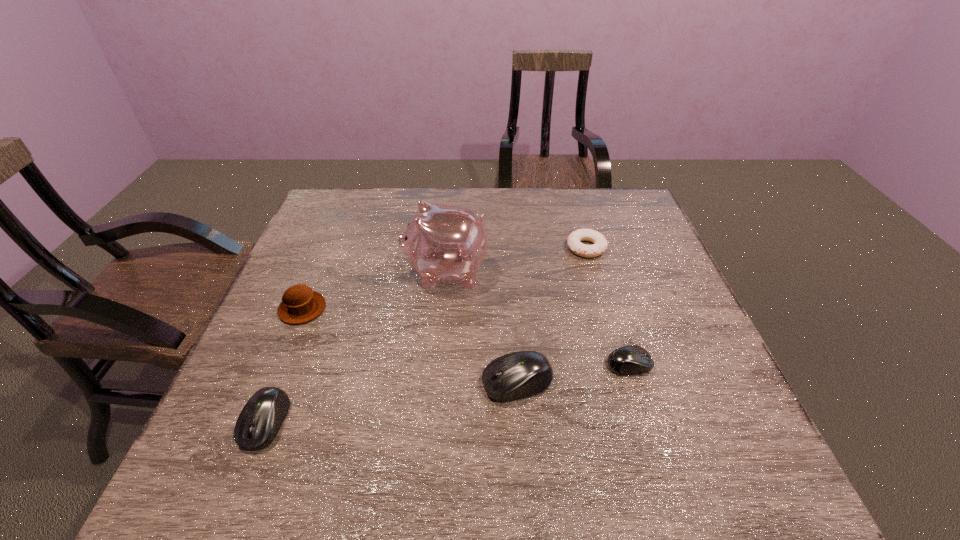
Find the location of a particular element. vacant space located 0.370m on the front of the shortest object is located at coordinates (621, 370).

At what (x,y) coordinates should I click in order to perform the action: click on vacant space situated on the front of the muffin. Please return your answer as a coordinate pair (x, y). The width and height of the screenshot is (960, 540). Looking at the image, I should click on (288, 342).

Image resolution: width=960 pixels, height=540 pixels. In order to click on vacant space located on the front facing side of the tallest object in this screenshot , I will do `click(319, 272)`.

The width and height of the screenshot is (960, 540). Find the location of `vacant space located on the front facing side of the tallest object`. vacant space located on the front facing side of the tallest object is located at coordinates (355, 272).

Locate an element on the screen. free region located 0.110m on the front facing side of the tallest object is located at coordinates point(363,272).

Find the location of a particular element. The width and height of the screenshot is (960, 540). mouse present at the left edge is located at coordinates (260, 420).

Image resolution: width=960 pixels, height=540 pixels. Find the location of `muffin positioned at the left edge`. muffin positioned at the left edge is located at coordinates (300, 304).

Locate an element on the screen. Image resolution: width=960 pixels, height=540 pixels. mouse that is at the right edge is located at coordinates (628, 360).

Identify the location of doughnut at the right edge. (599, 241).

At what (x,y) coordinates should I click in order to perform the action: click on object present at the near left corner. Please return your answer as a coordinate pair (x, y). Looking at the image, I should click on [260, 420].